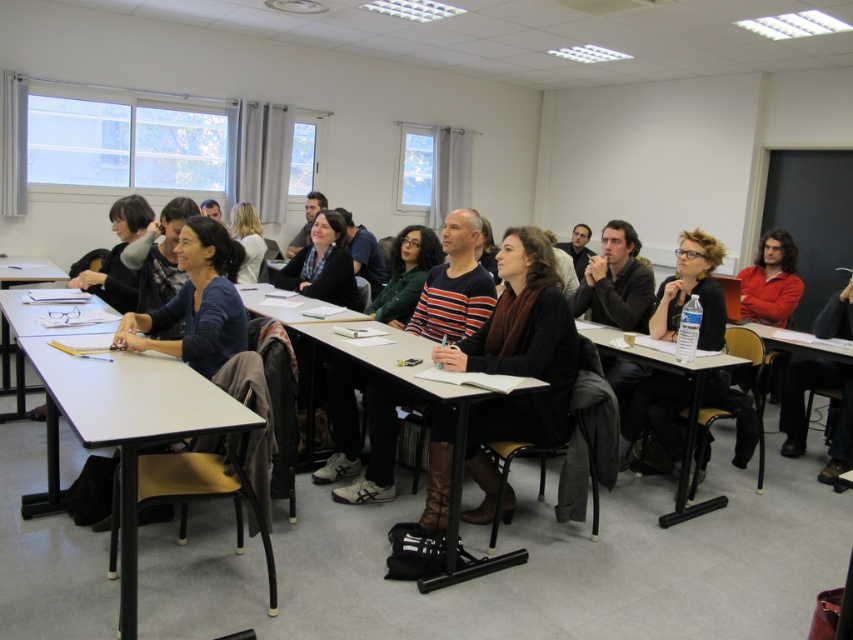
Question: Which point is closer to the camera?

Choices:
 (A) (688, 484)
 (B) (395, 355)
 (C) (128, 612)
 (D) (815, 384)

Answer: (C)

Question: Which of the following is the farthest from the observer?

Choices:
 (A) (396, 332)
 (B) (843, 412)
 (C) (469, 512)

Answer: (B)

Question: Which point is farther to the camera?

Choices:
 (A) wooden desk at center
 (B) white plastic table at center

Answer: (A)

Question: Can you confirm if wooden table at lower right is thinner than wooden desk at center?

Choices:
 (A) yes
 (B) no

Answer: (A)

Question: Is brown leather boots at center below wooden desk at center?

Choices:
 (A) no
 (B) yes

Answer: (A)

Question: Is the position of smooth wooden table at center less distant than that of wooden desk at center?

Choices:
 (A) no
 (B) yes

Answer: (B)